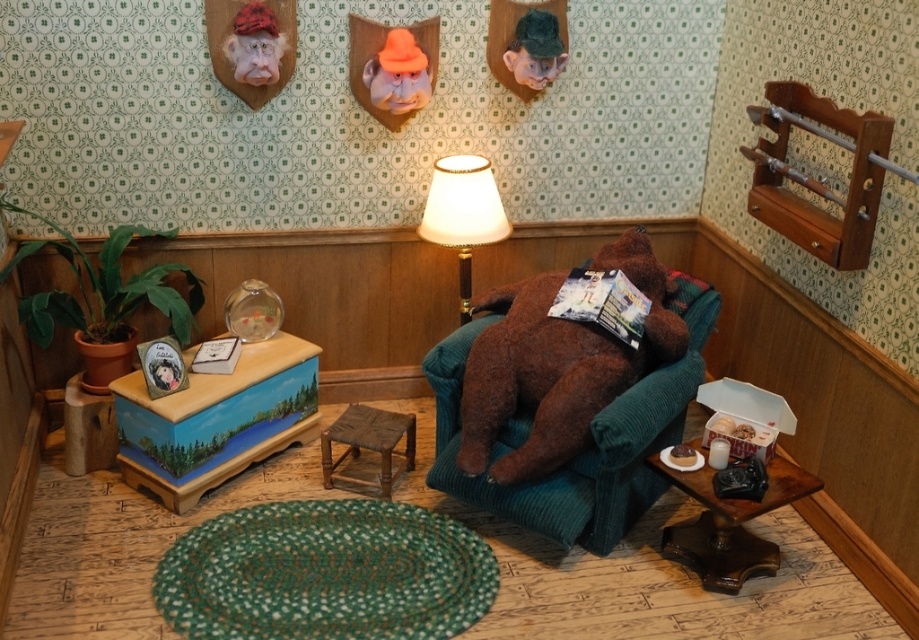
Question: Does white fabric lampshade at center appear under rustic wood stool at center?

Choices:
 (A) no
 (B) yes

Answer: (A)

Question: Considering the relative positions of white fabric lampshade at center and rustic wood stool at center in the image provided, where is white fabric lampshade at center located with respect to rustic wood stool at center?

Choices:
 (A) above
 (B) below

Answer: (A)

Question: Is brown plush bear at center bigger than white fabric lampshade at center?

Choices:
 (A) no
 (B) yes

Answer: (B)

Question: Which object appears closest to the camera in this image?

Choices:
 (A) rustic wood stool at center
 (B) brown plush bear at center

Answer: (B)

Question: Which point appears closest to the camera in this image?

Choices:
 (A) (609, 342)
 (B) (486, 232)
 (C) (407, 428)

Answer: (A)

Question: Which point is closer to the camera taking this photo?

Choices:
 (A) (379, 428)
 (B) (481, 225)

Answer: (A)